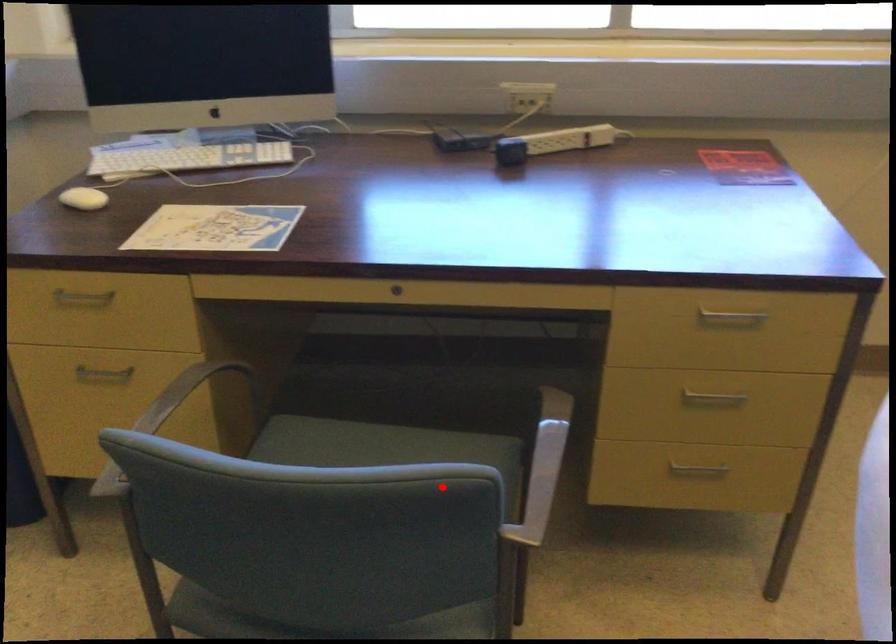
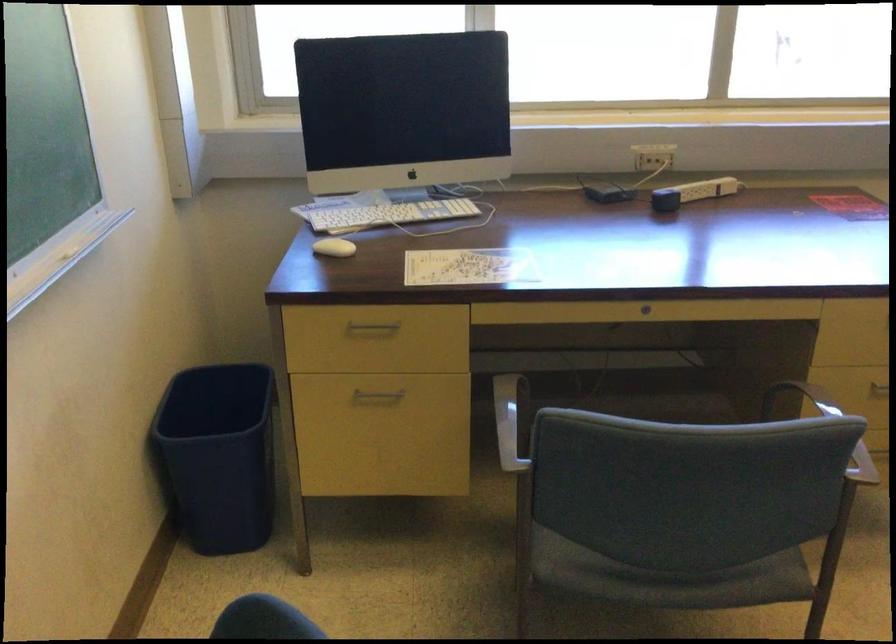
Question: I am providing you with two images of the same scene from different viewpoints. Given a red point in image1, look at the same physical point in image2. Is it:

Choices:
 (A) Closer to the viewpoint
 (B) Farther from the viewpoint

Answer: (B)